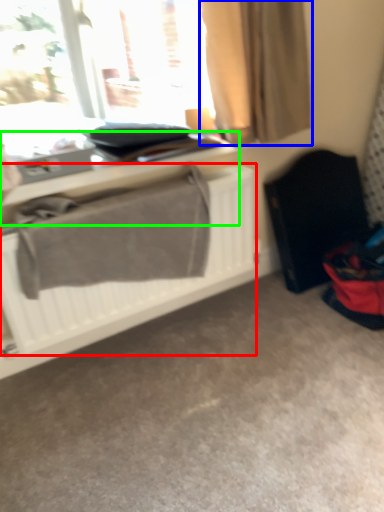
Question: Which object is the farthest from radiator (highlighted by a red box)? Choose among these: curtain (highlighted by a blue box) or table (highlighted by a green box).

Choices:
 (A) curtain
 (B) table

Answer: (A)